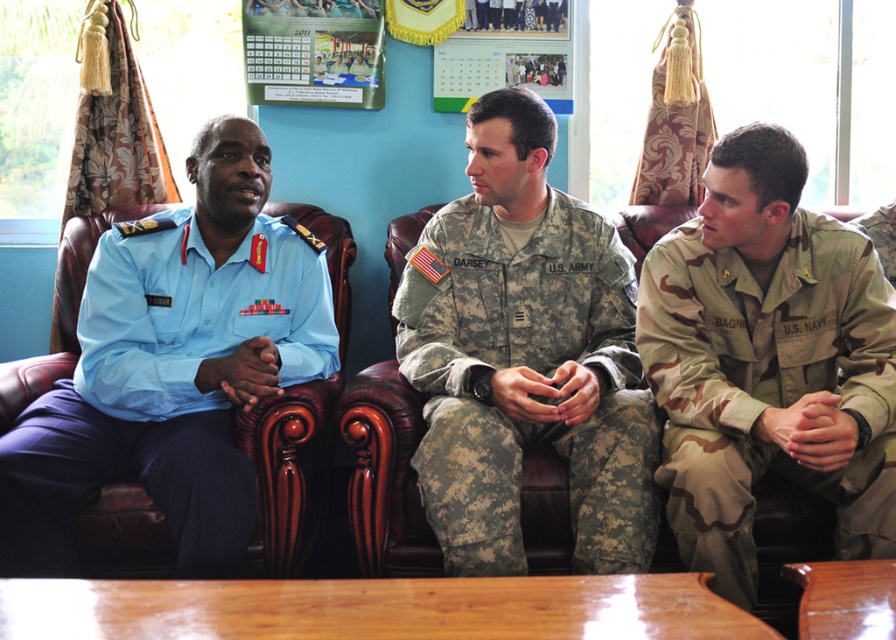
Question: Which point is closer to the camera?

Choices:
 (A) (457, 312)
 (B) (816, 337)
 (C) (177, 541)
 (D) (526, 518)

Answer: (C)

Question: Which of the following is the closest to the observer?

Choices:
 (A) (515, 323)
 (B) (751, 472)
 (C) (204, 314)
 (D) (91, 250)

Answer: (B)

Question: Considering the relative positions of brown leather couch at center and camouflage fabric us navy uniform at right in the image provided, where is brown leather couch at center located with respect to camouflage fabric us navy uniform at right?

Choices:
 (A) left
 (B) right

Answer: (A)

Question: Among these points, which one is farthest from the camera?

Choices:
 (A) (438, 556)
 (B) (502, 518)

Answer: (A)

Question: Considering the relative positions of light blue uniform at left and brown leather couch at center in the image provided, where is light blue uniform at left located with respect to brown leather couch at center?

Choices:
 (A) left
 (B) right

Answer: (A)

Question: Is light blue uniform at left closer to the viewer compared to brown leather couch at center?

Choices:
 (A) no
 (B) yes

Answer: (B)